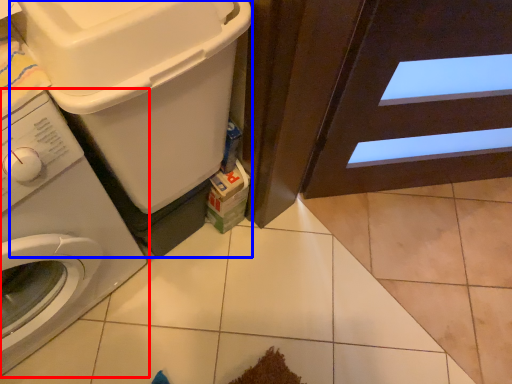
Question: Among these objects, which one is nearest to the camera, washing machine (highlighted by a red box) or washing machine (highlighted by a blue box)?

Choices:
 (A) washing machine
 (B) washing machine

Answer: (A)